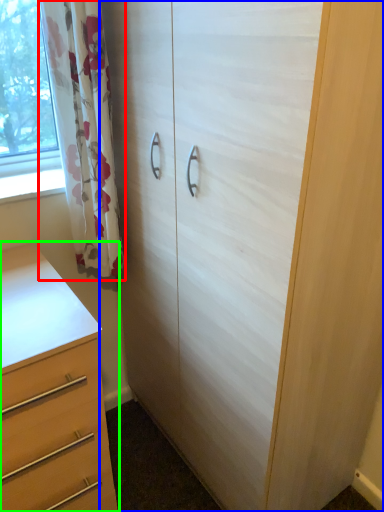
Question: Based on their relative distances, which object is farther from curtain (highlighted by a red box)? Choose from cupboard (highlighted by a blue box) and chest of drawers (highlighted by a green box).

Choices:
 (A) cupboard
 (B) chest of drawers

Answer: (B)